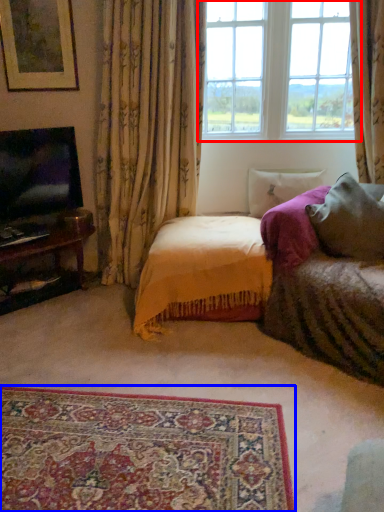
Question: Which of the following is the closest to the observer, window (highlighted by a red box) or plain (highlighted by a blue box)?

Choices:
 (A) window
 (B) plain

Answer: (B)